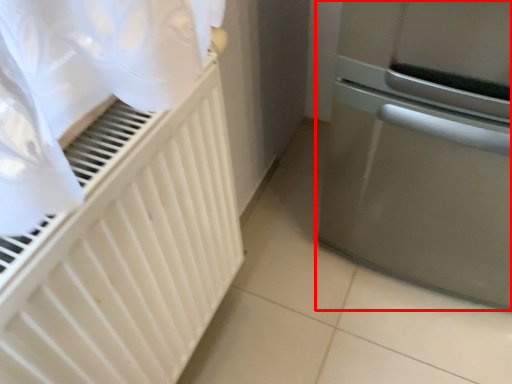
Question: From the image's perspective, where is home appliance (annotated by the red box) located relative to radiator?

Choices:
 (A) below
 (B) above

Answer: (B)